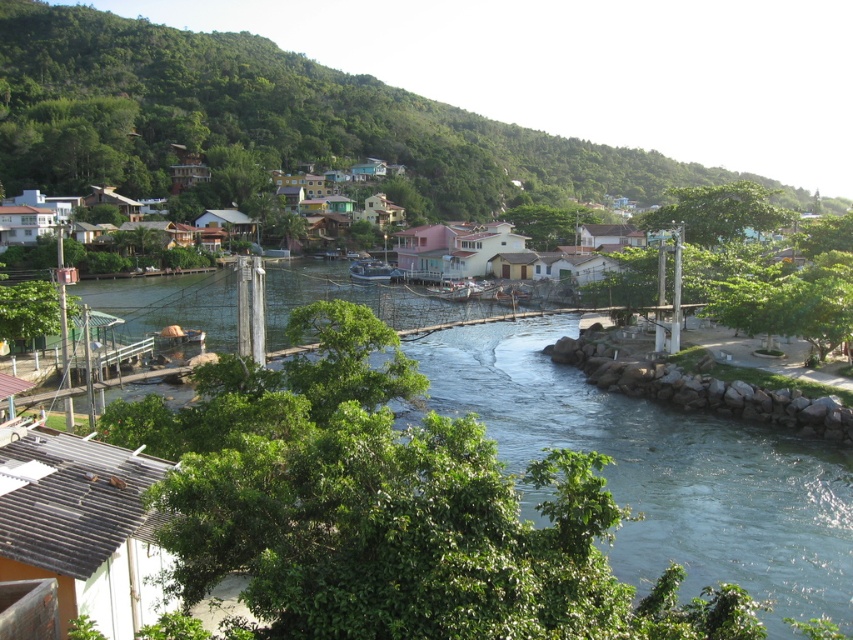
Question: Can you confirm if clear blue water at center is smaller than metallic silver boat at center?

Choices:
 (A) yes
 (B) no

Answer: (B)

Question: Does green leafy hillside at upper center appear over metallic silver boat at center?

Choices:
 (A) yes
 (B) no

Answer: (A)

Question: Among these points, which one is farthest from the camera?

Choices:
 (A) (779, 449)
 (B) (287, 60)
 (C) (364, 257)

Answer: (B)

Question: Which object is the closest to the green leafy hillside at upper center?

Choices:
 (A) metallic silver boat at center
 (B) clear blue water at center

Answer: (B)

Question: Is green leafy hillside at upper center positioned at the back of metallic silver boat at center?

Choices:
 (A) yes
 (B) no

Answer: (B)

Question: Which point is farther to the camera?

Choices:
 (A) clear blue water at center
 (B) metallic silver boat at center
 (C) green leafy hillside at upper center

Answer: (B)